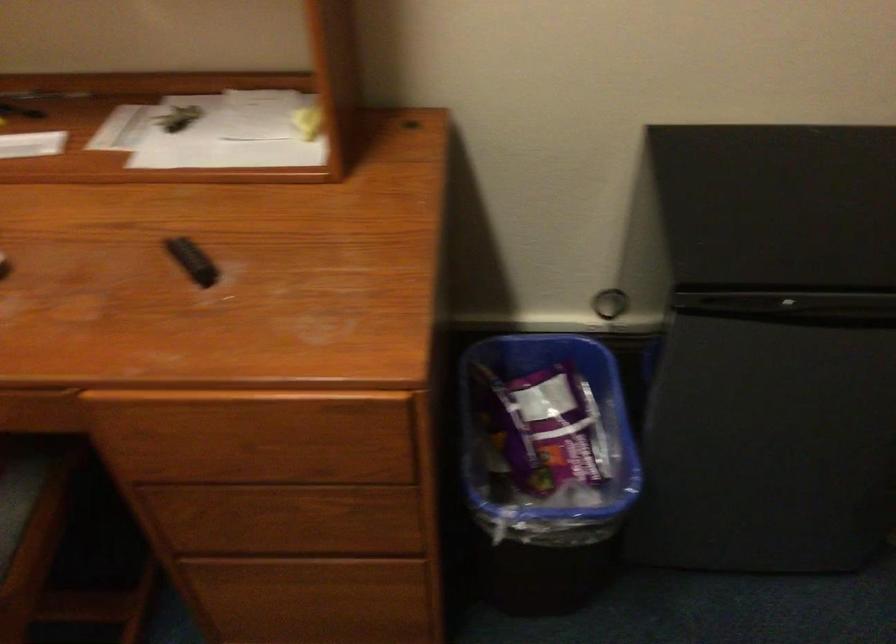
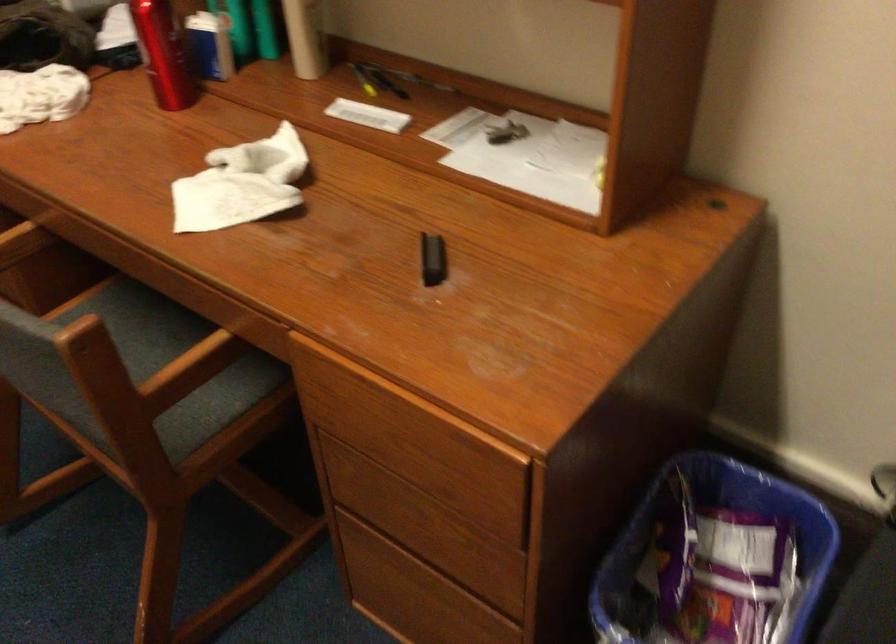
Locate, in the second image, the point that corresponds to (523,412) in the first image.

(711, 542)